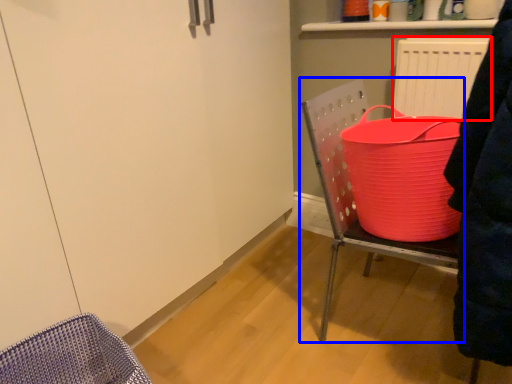
Question: Which object is further to the camera taking this photo, radiator (highlighted by a red box) or furniture (highlighted by a blue box)?

Choices:
 (A) radiator
 (B) furniture

Answer: (A)